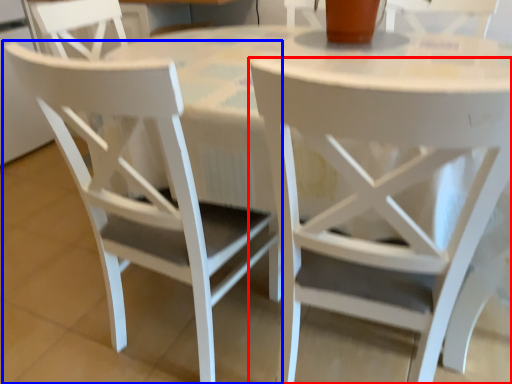
Question: Which point is closer to the camera, chair (highlighted by a red box) or chair (highlighted by a blue box)?

Choices:
 (A) chair
 (B) chair

Answer: (A)